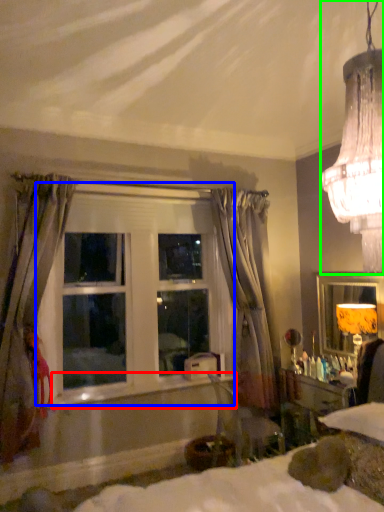
Question: Which object is positioned farthest from window sill (highlighted by a red box)? Select from window (highlighted by a blue box) and lamp (highlighted by a green box).

Choices:
 (A) window
 (B) lamp

Answer: (B)